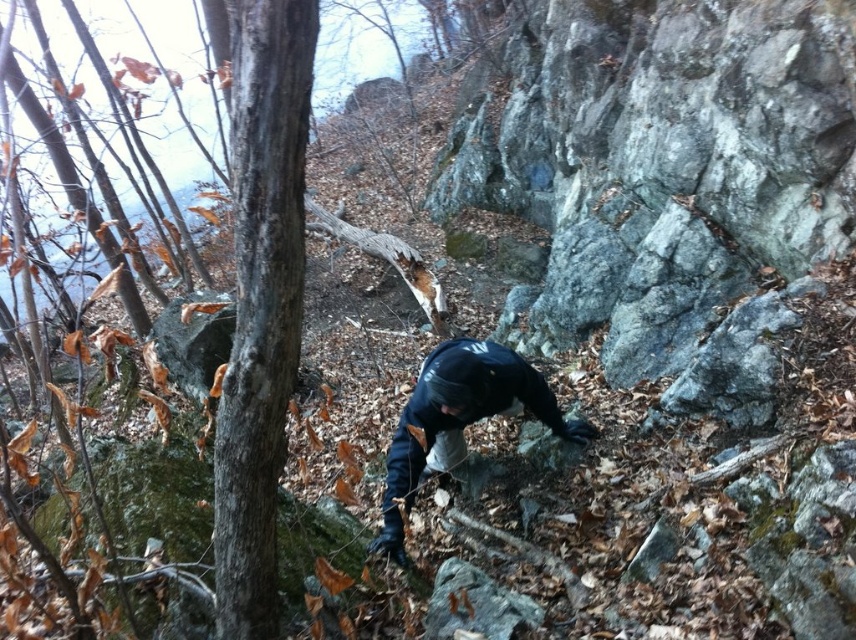
Consider the image. You are hiking on a rocky hillside during autumn and see both the smooth brown bark at center and the smooth bark tree at center. Which object is farther away from you?

The smooth bark tree at center is farther away because it is positioned behind the smooth brown bark at center.

You are a hiker who has just spotted two objects in the center of the image. One is smooth brown bark at center and the other is smooth bark tree at center. Which one is positioned to the left?

The smooth brown bark at center is positioned to the left of the smooth bark tree at center.